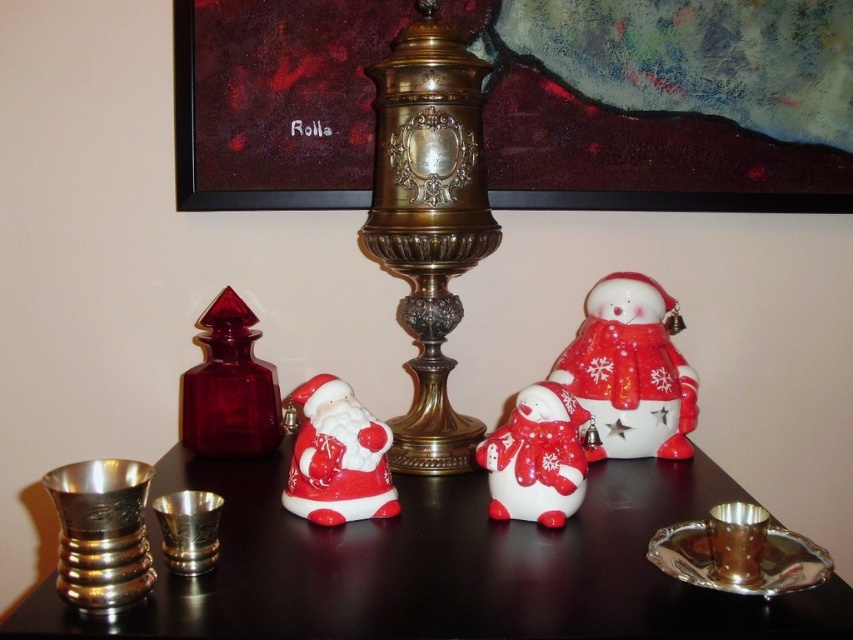
Does brushed metal cups at left have a greater height compared to matte ceramic santa at center?

In fact, brushed metal cups at left may be shorter than matte ceramic santa at center.

Does brushed metal cups at left have a smaller size compared to matte ceramic santa at center?

Actually, brushed metal cups at left might be larger than matte ceramic santa at center.

This screenshot has height=640, width=853. What are the coordinates of `brushed metal cups at left` in the screenshot? It's located at (444, 566).

At what (x,y) coordinates should I click in order to perform the action: click on brushed metal cups at left. Please return your answer as a coordinate pair (x, y). Image resolution: width=853 pixels, height=640 pixels. Looking at the image, I should click on (444, 566).

Is matte ceramic santa at center smaller than brushed metal candle holder at lower left?

Actually, matte ceramic santa at center might be larger than brushed metal candle holder at lower left.

At what (x,y) coordinates should I click in order to perform the action: click on matte ceramic santa at center. Please return your answer as a coordinate pair (x, y). The image size is (853, 640). Looking at the image, I should click on (338, 458).

The width and height of the screenshot is (853, 640). Describe the element at coordinates (338, 458) in the screenshot. I see `matte ceramic santa at center` at that location.

You are a GUI agent. You are given a task and a screenshot of the screen. Output one action in this format:
    pyautogui.click(x=<x>, y=<y>)
    Task: Click on the matte ceramic santa at center
    This screenshot has width=853, height=640.
    Given the screenshot: What is the action you would take?
    pyautogui.click(x=338, y=458)

Who is more distant from viewer, (437, 97) or (202, 333)?

Positioned behind is point (202, 333).

Who is lower down, brass/copper candle holder at center or ruby glass bottle at left?

ruby glass bottle at left is below.

Measure the distance between brass/copper candle holder at center and camera.

brass/copper candle holder at center is 33.69 inches from camera.

Where is `brass/copper candle holder at center`? Image resolution: width=853 pixels, height=640 pixels. brass/copper candle holder at center is located at coordinates (428, 221).